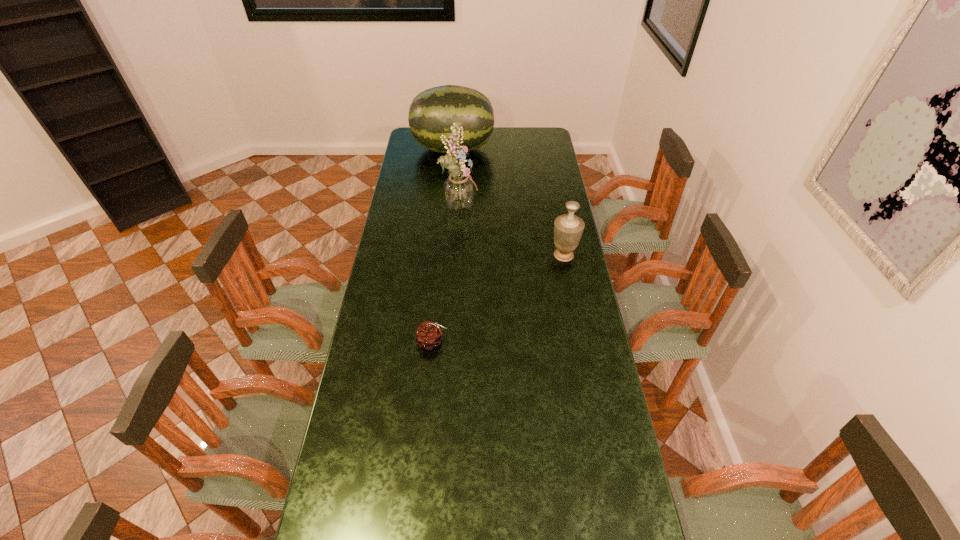
Where is `free location that satisfies the following two spatial constraints: 1. on the front side of the farthest object; 2. on the right side of the rightmost object`? The image size is (960, 540). free location that satisfies the following two spatial constraints: 1. on the front side of the farthest object; 2. on the right side of the rightmost object is located at coordinates (444, 255).

At what (x,y) coordinates should I click in order to perform the action: click on vacant region that satisfies the following two spatial constraints: 1. on the front side of the second shortest object; 2. on the left side of the third shortest object. Please return your answer as a coordinate pair (x, y). This screenshot has width=960, height=540. Looking at the image, I should click on (444, 255).